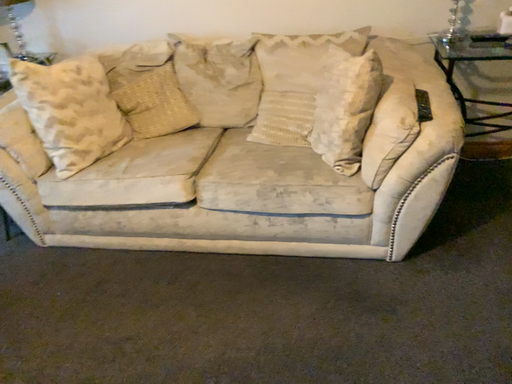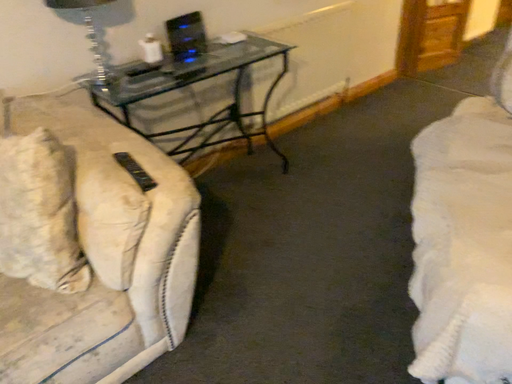
Question: Which way did the camera rotate in the video?

Choices:
 (A) rotated left
 (B) rotated right

Answer: (B)